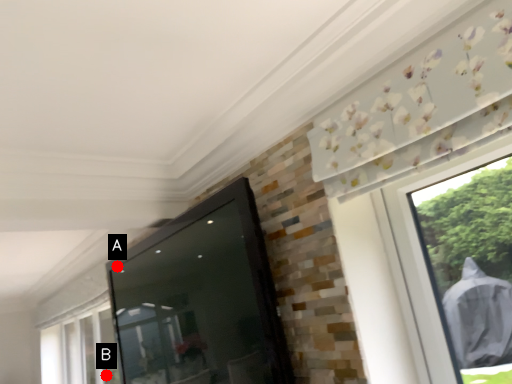
Question: Two points are circled on the image, labeled by A and B beside each circle. Which point is closer to the camera taking this photo?

Choices:
 (A) A is closer
 (B) B is closer

Answer: (A)